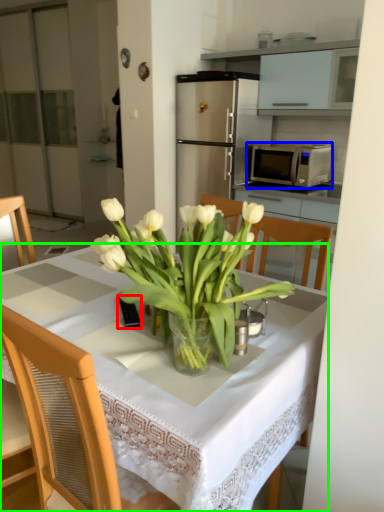
Question: Based on their relative distances, which object is farther from corded phone (highlighted by a red box)? Choose from microwave oven (highlighted by a blue box) and desk (highlighted by a green box).

Choices:
 (A) microwave oven
 (B) desk

Answer: (A)